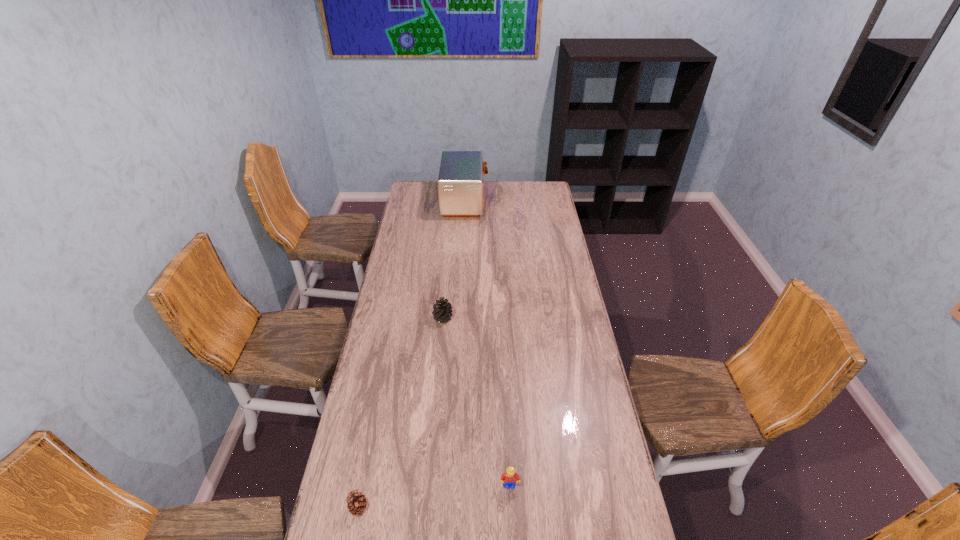
In order to click on vacant area located 0.080m on the front-facing side of the rightmost object in this screenshot , I will do `click(511, 517)`.

The image size is (960, 540). In order to click on vacant space situated on the right of the left pinecone in this screenshot , I will do `click(505, 508)`.

Locate an element on the screen. The height and width of the screenshot is (540, 960). object that is at the far edge is located at coordinates (460, 182).

Identify the location of object that is positioned at the left edge. The width and height of the screenshot is (960, 540). (356, 503).

Identify the location of vacant space at the left edge of the desktop. This screenshot has height=540, width=960. (335, 535).

Identify the location of vacant space at the right edge. (577, 431).

This screenshot has width=960, height=540. Identify the location of vacant space at the far left corner of the desktop. (431, 185).

The height and width of the screenshot is (540, 960). What are the coordinates of `blank space at the far right corner` in the screenshot? It's located at (547, 198).

Where is `empty space that is in between the left pinecone and the right pinecone`? This screenshot has width=960, height=540. empty space that is in between the left pinecone and the right pinecone is located at coordinates coord(400,413).

You are a GUI agent. You are given a task and a screenshot of the screen. Output one action in this format:
    pyautogui.click(x=<x>, y=<y>)
    Task: Click on the empty space between the rightmost object and the toaster oven
    The image size is (960, 540).
    Given the screenshot: What is the action you would take?
    pyautogui.click(x=488, y=343)